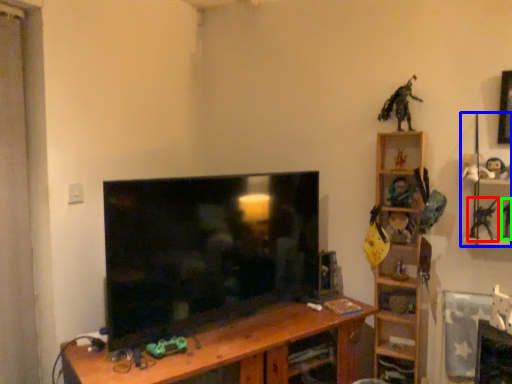
Question: Which object is the farthest from toy (highlighted by a red box)? Choose among these: toy (highlighted by a blue box) or toy (highlighted by a green box).

Choices:
 (A) toy
 (B) toy

Answer: (B)